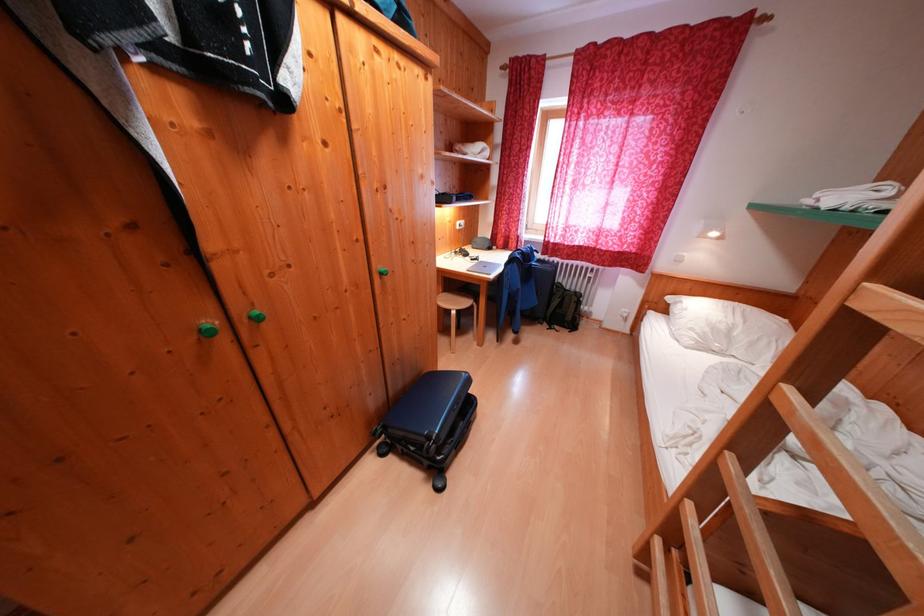
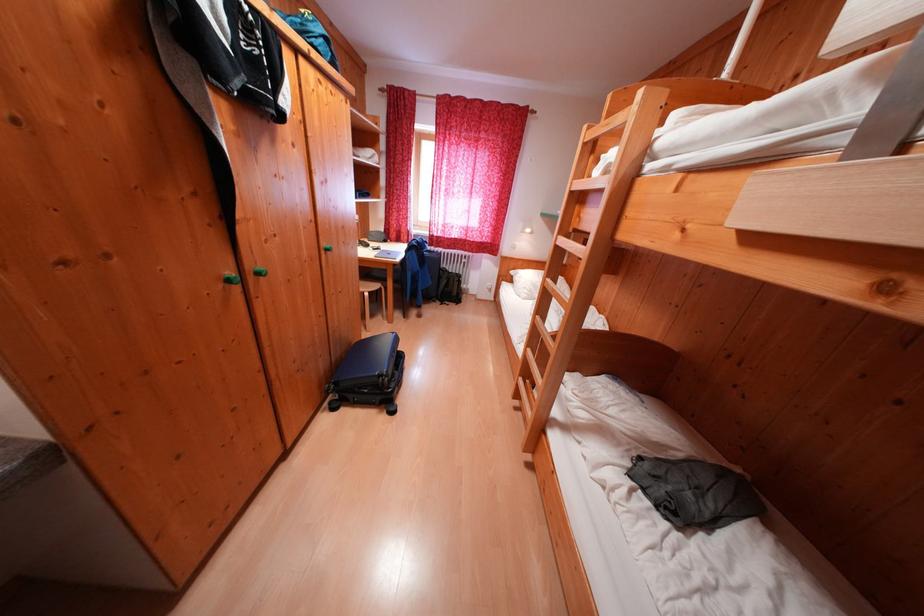
Locate, in the second image, the point that corresponds to point 673,314 in the first image.

(518, 284)